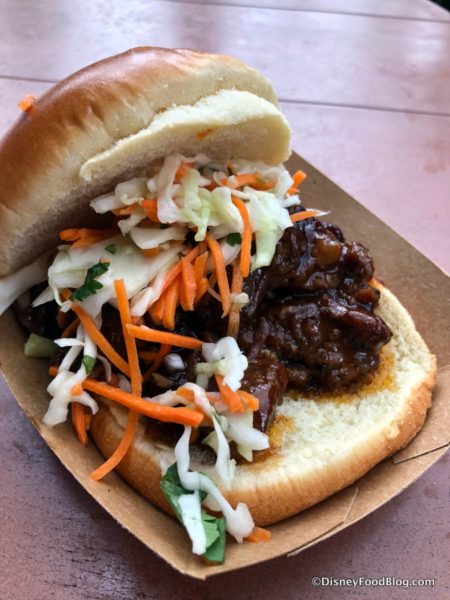
The width and height of the screenshot is (450, 600). Identify the location of table. (50, 513), (406, 538), (403, 199).